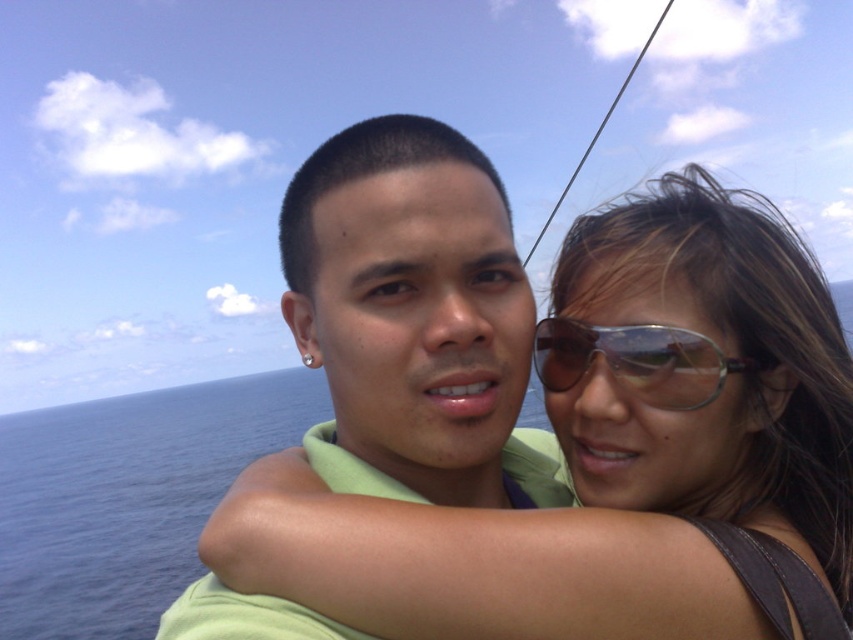
You are a photographer trying to capture a candid shot of the matte green shirt at center and sunglasses at center. If you want to ensure both are fully visible in the frame, which object should you position closer to the edge of the frame to avoid cropping?

The sunglasses at center should be positioned closer to the edge of the frame because the matte green shirt at center might be wider than sunglasses at center, so it requires more space to fit entirely within the frame.

You are a photographer taking a picture of the matte green shirt at center and the sunglasses at center. Which object should you adjust to ensure both are centered in the frame?

The matte green shirt at center is to the left of sunglasses at center, so you should move the matte green shirt at center to the right or the sunglasses at center to the left to center both in the frame.